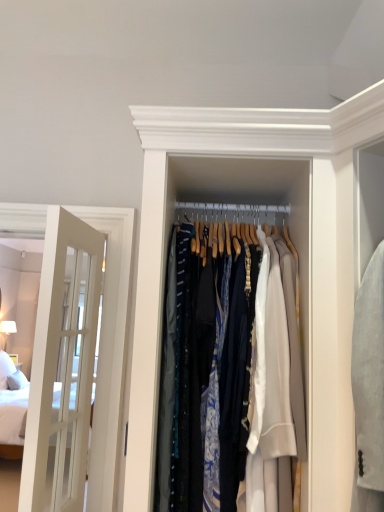
Image resolution: width=384 pixels, height=512 pixels. Describe the element at coordinates (62, 365) in the screenshot. I see `white glass door at left` at that location.

I want to click on white glass door at left, so click(62, 365).

The height and width of the screenshot is (512, 384). Describe the element at coordinates (229, 356) in the screenshot. I see `silky fabric clothes at center` at that location.

At what (x,y) coordinates should I click in order to perform the action: click on silky fabric clothes at center. Please return your answer as a coordinate pair (x, y). Looking at the image, I should click on (229, 356).

Where is `white glass door at left`? The width and height of the screenshot is (384, 512). white glass door at left is located at coordinates (62, 365).

Is silky fabric clothes at center at the left side of white glass door at left?

No.

Is silky fabric clothes at center positioned behind white glass door at left?

No.

Which is in front, point (236, 300) or point (57, 382)?

Point (236, 300)

From the image's perspective, is silky fabric clothes at center below white glass door at left?

Answer: No, from the image's perspective, silky fabric clothes at center is not beneath white glass door at left.

From a real-world perspective, who is located higher, silky fabric clothes at center or white glass door at left?

silky fabric clothes at center.

Considering the sizes of objects silky fabric clothes at center and white glass door at left in the image provided, who is thinner, silky fabric clothes at center or white glass door at left?

Thinner between the two is white glass door at left.

Can you confirm if silky fabric clothes at center is taller than white glass door at left?

In fact, silky fabric clothes at center may be shorter than white glass door at left.

Between silky fabric clothes at center and white glass door at left, which one has larger size?

silky fabric clothes at center is bigger.

Is white glass door at left surrounded by silky fabric clothes at center?

No, white glass door at left is not a part of silky fabric clothes at center.

Is silky fabric clothes at center not near white glass door at left?

That's not correct — silky fabric clothes at center is a little close to white glass door at left.

Based on the photo, could you tell me if silky fabric clothes at center is facing white glass door at left?

No.

How many degrees apart are the facing directions of silky fabric clothes at center and white glass door at left?

92.9 degrees separate the facing orientations of silky fabric clothes at center and white glass door at left.

What are the coordinates of `door beneath the silky fabric clothes at center (from a real-world perspective)` in the screenshot? It's located at (62, 365).

Between white glass door at left and silky fabric clothes at center, which one appears on the left side from the viewer's perspective?

Positioned to the left is white glass door at left.

Is the position of white glass door at left more distant than that of silky fabric clothes at center?

Yes, it is.

Is point (45, 396) positioned behind point (300, 434)?

Yes, point (45, 396) is farther from viewer.

From the image's perspective, is white glass door at left located above or below silky fabric clothes at center?

white glass door at left is below silky fabric clothes at center.

Consider the image. From a real-world perspective, is white glass door at left above or below silky fabric clothes at center?

From a real-world perspective, white glass door at left is physically below silky fabric clothes at center.

Is white glass door at left wider or thinner than silky fabric clothes at center?

white glass door at left is thinner than silky fabric clothes at center.

Is white glass door at left taller or shorter than silky fabric clothes at center?

Considering their sizes, white glass door at left has more height than silky fabric clothes at center.

Does white glass door at left have a smaller size compared to silky fabric clothes at center?

Correct, white glass door at left occupies less space than silky fabric clothes at center.

Is silky fabric clothes at center inside white glass door at left?

No, silky fabric clothes at center is not a part of white glass door at left.

Does white glass door at left touch silky fabric clothes at center?

No, white glass door at left is not touching silky fabric clothes at center.

Could you tell me if white glass door at left is facing silky fabric clothes at center?

No, white glass door at left is not facing towards silky fabric clothes at center.

The image size is (384, 512). I want to click on door below the silky fabric clothes at center (from a real-world perspective), so click(62, 365).

Where is `door below the silky fabric clothes at center (from the image's perspective)`? door below the silky fabric clothes at center (from the image's perspective) is located at coordinates (62, 365).

At what (x,y) coordinates should I click in order to perform the action: click on closet on the right of the white glass door at left. Please return your answer as a coordinate pair (x, y). Image resolution: width=384 pixels, height=512 pixels. Looking at the image, I should click on (229, 356).